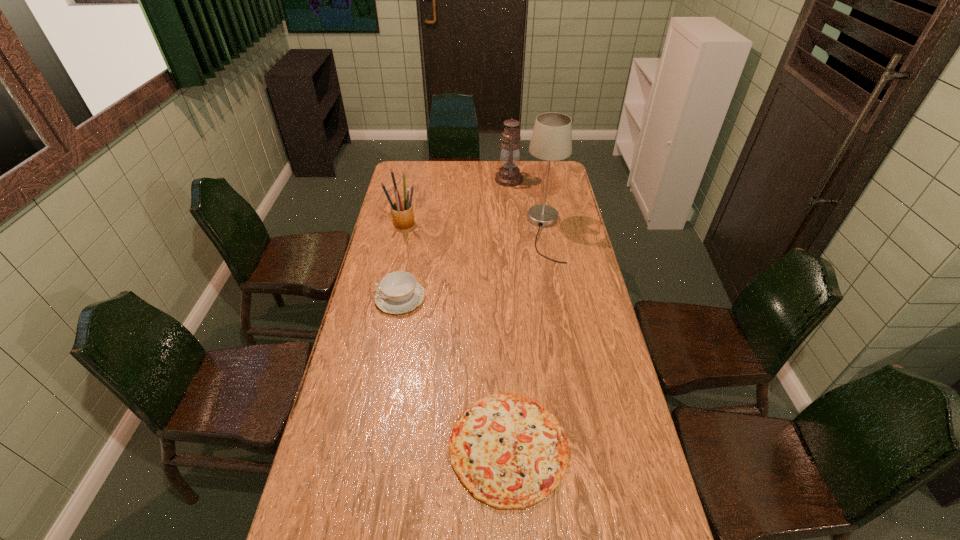
Point out which object is positioned as the second nearest to the shortest object. Please provide its 2D coordinates. Your answer should be formatted as a tuple, i.e. [(x, y)], where the tuple contains the x and y coordinates of a point satisfying the conditions above.

[(551, 140)]

Identify which object is the fourth closest to the oil lamp. Please provide its 2D coordinates. Your answer should be formatted as a tuple, i.e. [(x, y)], where the tuple contains the x and y coordinates of a point satisfying the conditions above.

[(509, 451)]

Locate an element on the screen. This screenshot has height=540, width=960. free space that satisfies the following two spatial constraints: 1. on the front side of the nearest object; 2. on the right side of the third shortest object is located at coordinates (356, 447).

Find the location of `free location that satisfies the following two spatial constraints: 1. on the back side of the nearest object; 2. on the left side of the tallest object`. free location that satisfies the following two spatial constraints: 1. on the back side of the nearest object; 2. on the left side of the tallest object is located at coordinates (498, 234).

What are the coordinates of `free space that satisfies the following two spatial constraints: 1. on the back side of the nearest object; 2. on the right side of the oil lamp` in the screenshot? It's located at (495, 179).

Where is `free point that satisfies the following two spatial constraints: 1. on the front side of the tallest object; 2. on the handle side of the chinaware`? This screenshot has width=960, height=540. free point that satisfies the following two spatial constraints: 1. on the front side of the tallest object; 2. on the handle side of the chinaware is located at coordinates (557, 298).